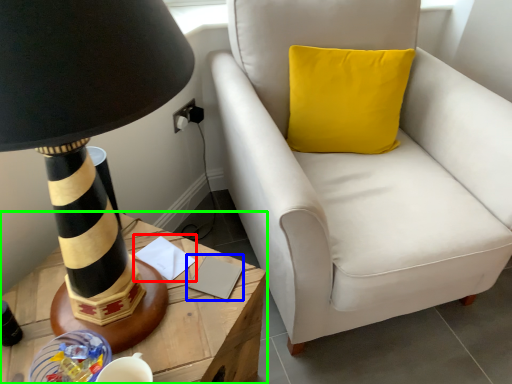
Question: Based on their relative distances, which object is farther from notepad (highlighted by a red box)? Choose from notepad (highlighted by a blue box) and table (highlighted by a green box).

Choices:
 (A) notepad
 (B) table

Answer: (B)